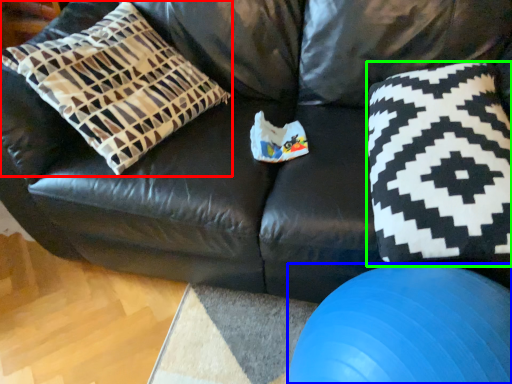
Question: Which object is positioned closest to pillow (highlighted by a red box)? Select from ball (highlighted by a blue box) and throw pillow (highlighted by a green box).

Choices:
 (A) ball
 (B) throw pillow

Answer: (B)